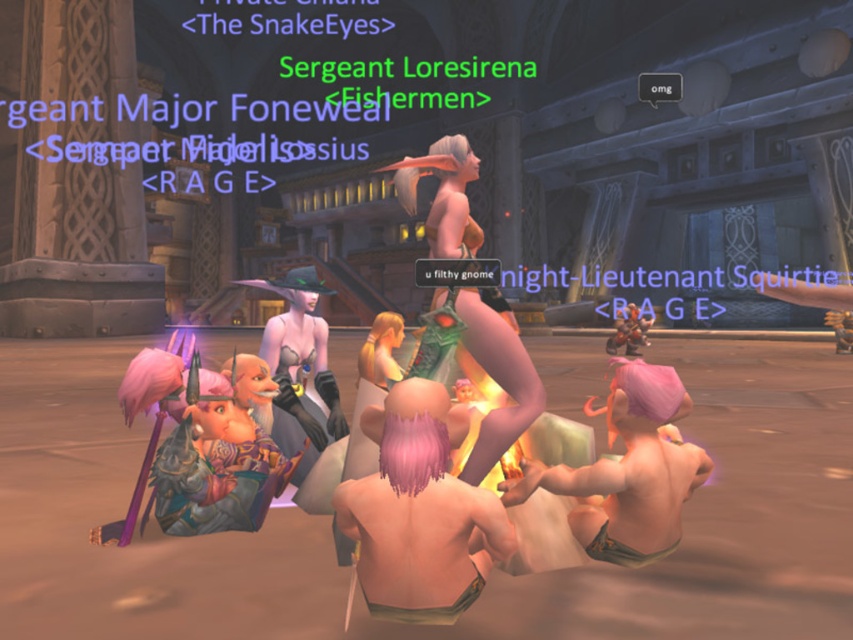
You are a game developer working on a fantasy MMORPG. You need to ensure that the pink fabric gnome at lower right and the green leather armor at center are positioned so that players can easily see both in the scene. Given that the minimum recommended distance between two interactive objects for clear visibility is 15 inches, does the current placement meet this requirement?

The pink fabric gnome at lower right and green leather armor at center are 15.83 inches apart from each other, which exceeds the minimum recommended distance of 15 inches. Therefore, the current placement meets the requirement for clear visibility.

You are a new player in the game and need to locate the green leather armor at center. Based on the coordinates provided, where should you look in the game screen?

The green leather armor at center is located at coordinates point (497, 381), which is near the center of the screen.